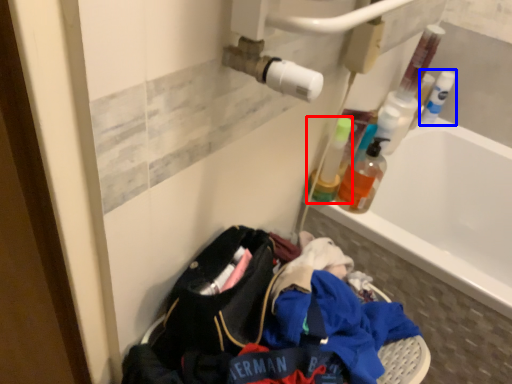
Question: Which point is further to the camera, bottle (highlighted by a red box) or bottle (highlighted by a blue box)?

Choices:
 (A) bottle
 (B) bottle

Answer: (B)